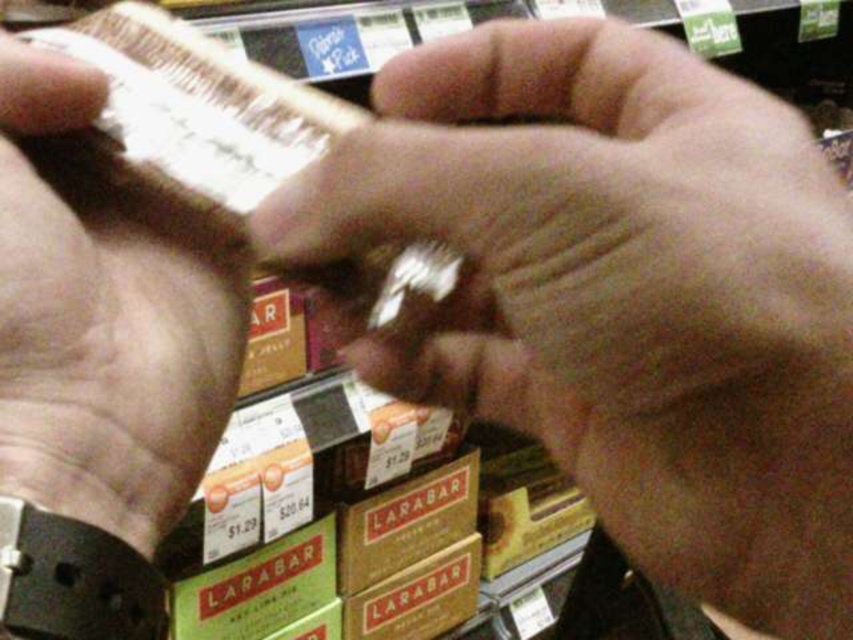
Can you confirm if matte plastic hand at center is positioned below smooth brown leather wallet at left?

Actually, matte plastic hand at center is above smooth brown leather wallet at left.

In the scene shown: Between matte plastic hand at center and smooth brown leather wallet at left, which one appears on the left side from the viewer's perspective?

smooth brown leather wallet at left is more to the left.

Is point (575, 108) positioned before point (27, 172)?

No.

What are the coordinates of `matte plastic hand at center` in the screenshot? It's located at (624, 294).